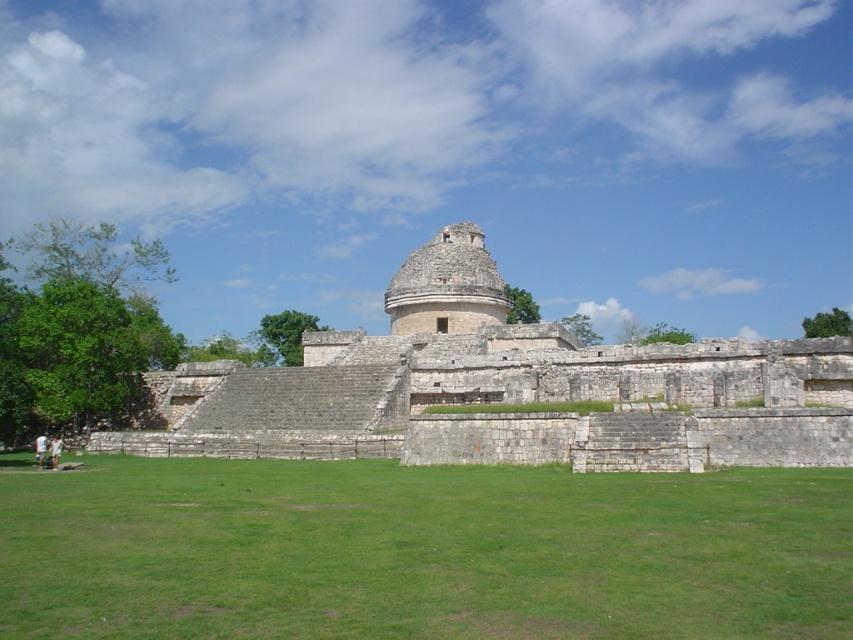
Question: Does green grass at center appear over white stone dome at center?

Choices:
 (A) yes
 (B) no

Answer: (B)

Question: Which point is closer to the camera?

Choices:
 (A) white stone dome at center
 (B) stone dome at center

Answer: (B)

Question: Based on their relative distances, which object is farther from the white stone dome at center?

Choices:
 (A) stone dome at center
 (B) green grass at center

Answer: (B)

Question: Does green grass at center have a larger size compared to white stone dome at center?

Choices:
 (A) yes
 (B) no

Answer: (B)

Question: Among these points, which one is nearest to the camera?

Choices:
 (A) (624, 554)
 (B) (639, 403)
 (C) (471, 324)

Answer: (A)

Question: Is stone dome at center below white stone dome at center?

Choices:
 (A) no
 (B) yes

Answer: (B)